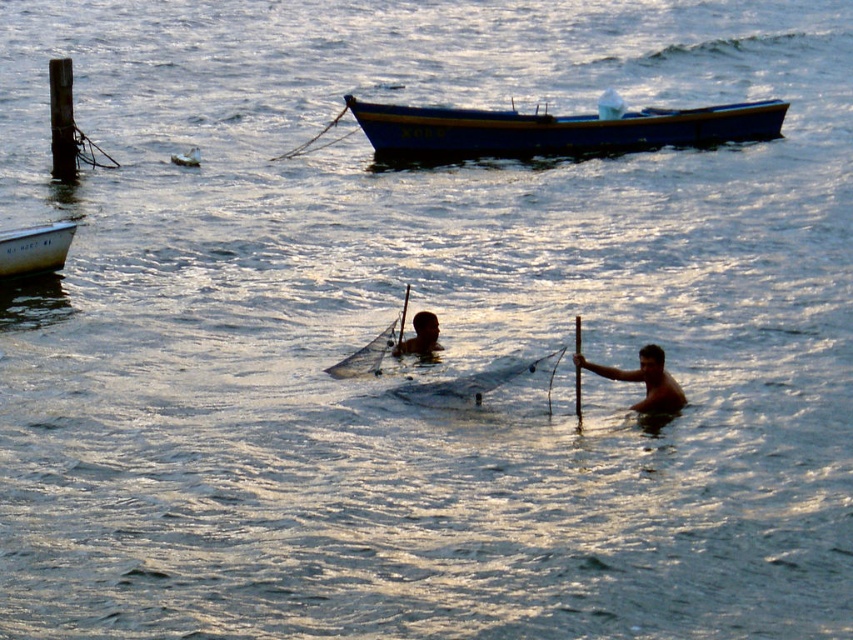
Question: Does skinny man at center have a smaller size compared to smooth skin man at center?

Choices:
 (A) yes
 (B) no

Answer: (B)

Question: Which is nearer to the skinny man at center?

Choices:
 (A) white plastic bottle at upper left
 (B) white plastic boat at left
 (C) smooth skin man at center

Answer: (C)

Question: Which object is positioned farthest from the white plastic bottle at upper left?

Choices:
 (A) blue polished wood boat at upper center
 (B) smooth skin man at center
 (C) skinny man at center

Answer: (C)

Question: Can you confirm if white plastic boat at left is bigger than white plastic bottle at upper left?

Choices:
 (A) no
 (B) yes

Answer: (B)

Question: Is blue polished wood boat at upper center bigger than white plastic bottle at upper left?

Choices:
 (A) no
 (B) yes

Answer: (A)

Question: Which object is the closest to the blue polished wood boat at upper center?

Choices:
 (A) skinny man at center
 (B) smooth skin man at center
 (C) white plastic bottle at upper left
 (D) white plastic boat at left

Answer: (C)